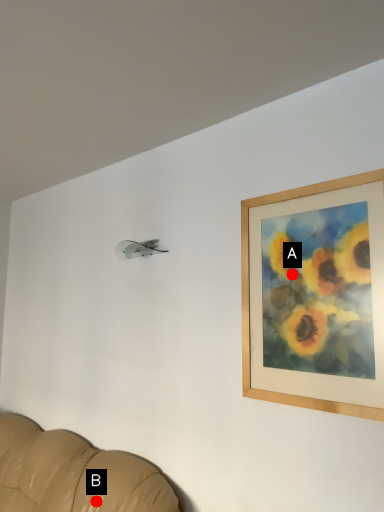
Question: Two points are circled on the image, labeled by A and B beside each circle. Which point is closer to the camera taking this photo?

Choices:
 (A) A is closer
 (B) B is closer

Answer: (A)